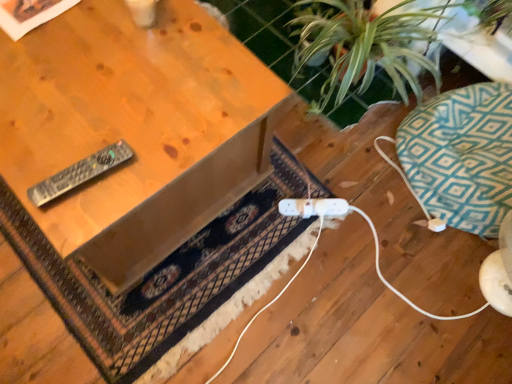
Identify the location of empty space that is in between wooden table at upper left and white plastic plug at lower center. (252, 220).